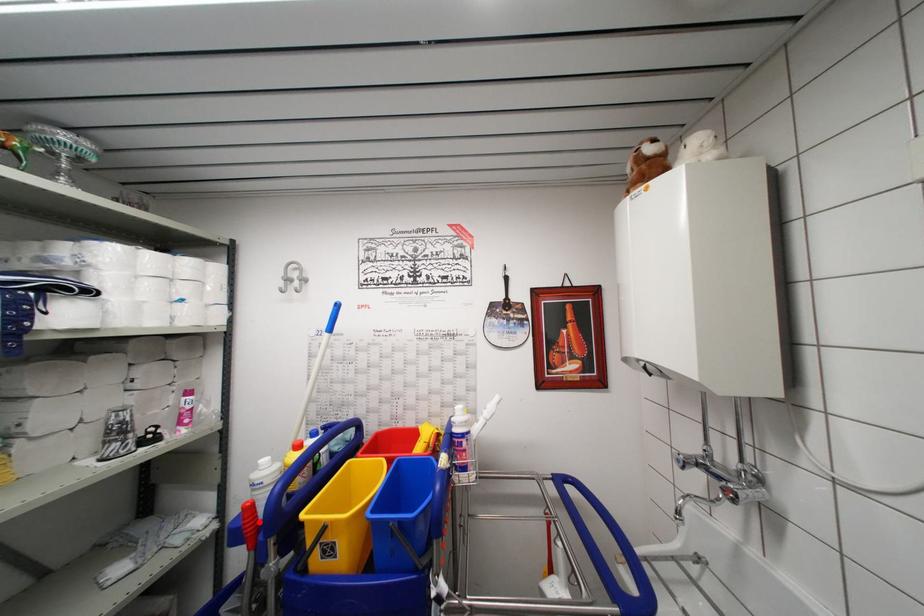
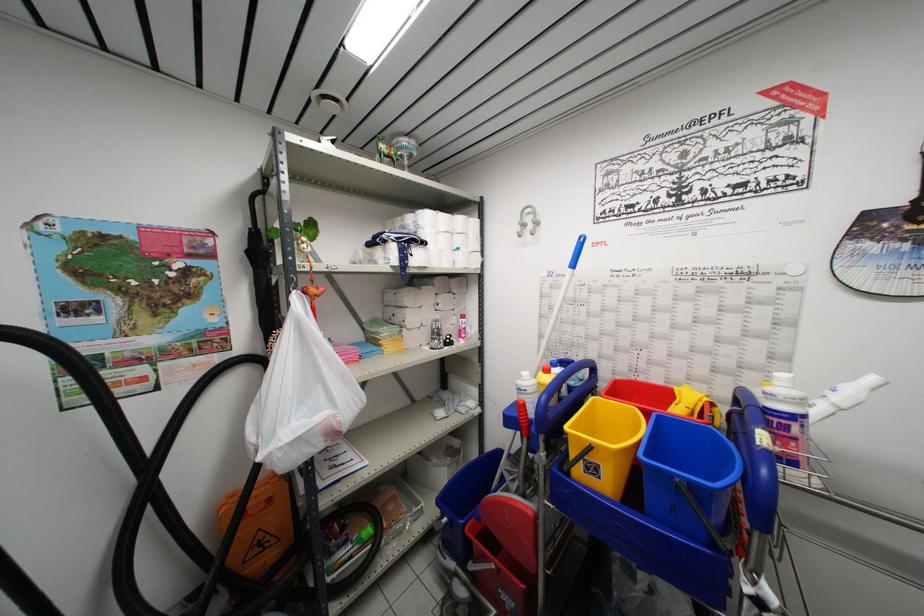
Locate, in the second image, the point that corresponds to the highlighted location in the first image.

(530, 419)